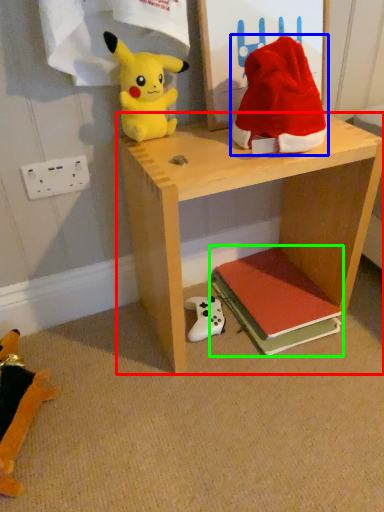
Question: Which object is positioned closest to shelf (highlighted by a red box)? Select from toy (highlighted by a blue box) and book (highlighted by a green box).

Choices:
 (A) toy
 (B) book

Answer: (A)